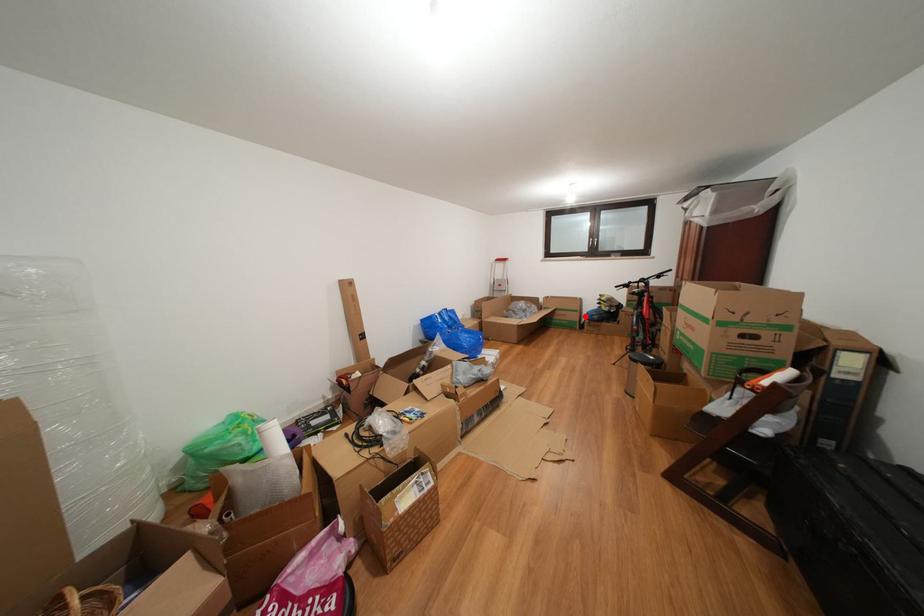
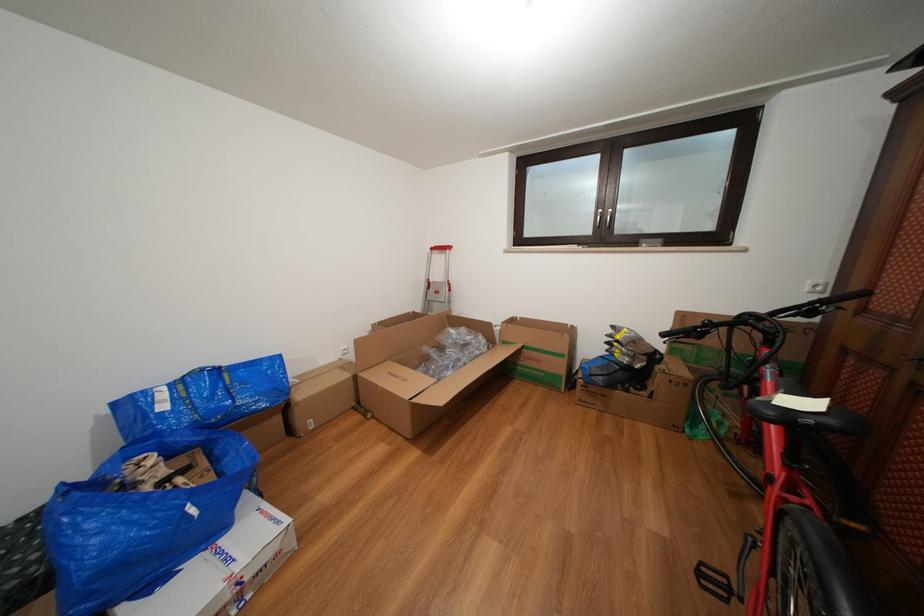
The point at the highlighted location is marked in the first image. Where is the corresponding point in the second image?

(570, 361)